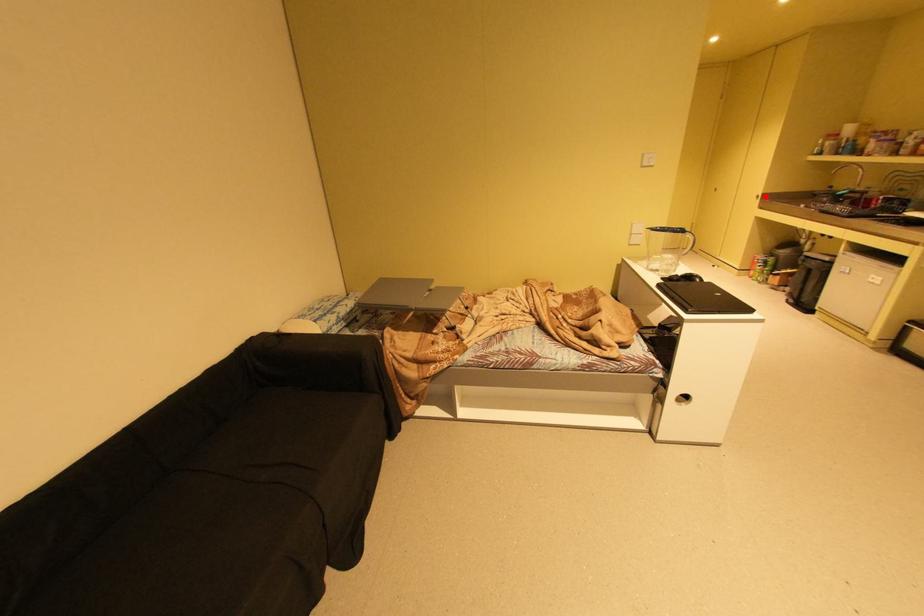
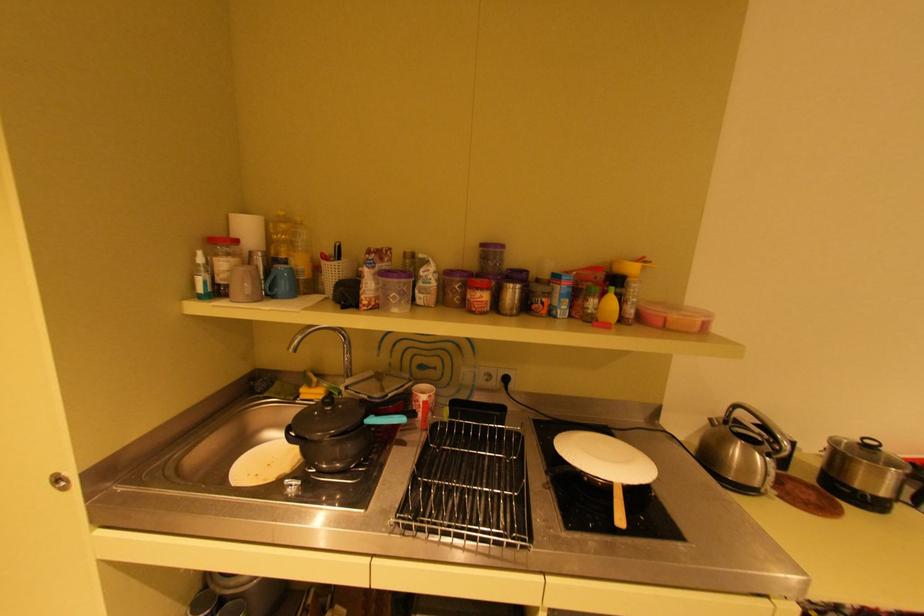
Locate, in the second image, the point that corresponds to the highlighted location in the first image.

(65, 479)